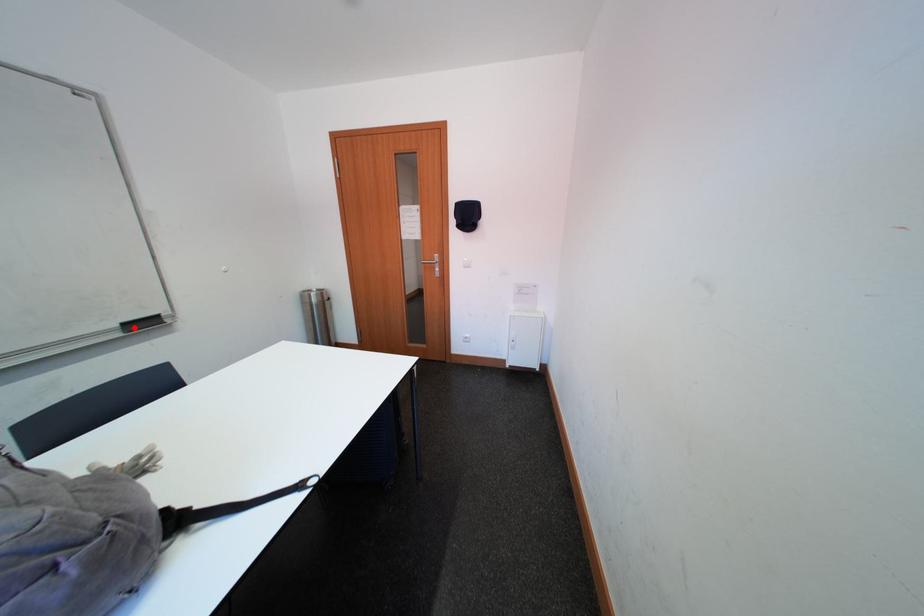
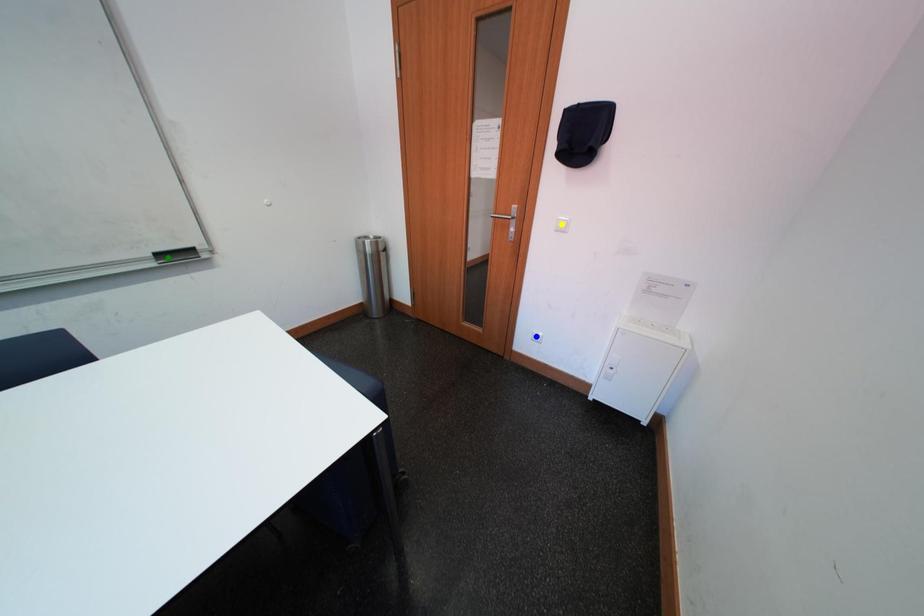
Question: I am providing you with two images of the same scene from different viewpoints. A red point is marked on the first image. You are given multiple points on the second image. In image 2, which mark is for the same physical point as the one in image 1?

Choices:
 (A) yellow point
 (B) green point
 (C) blue point

Answer: (B)